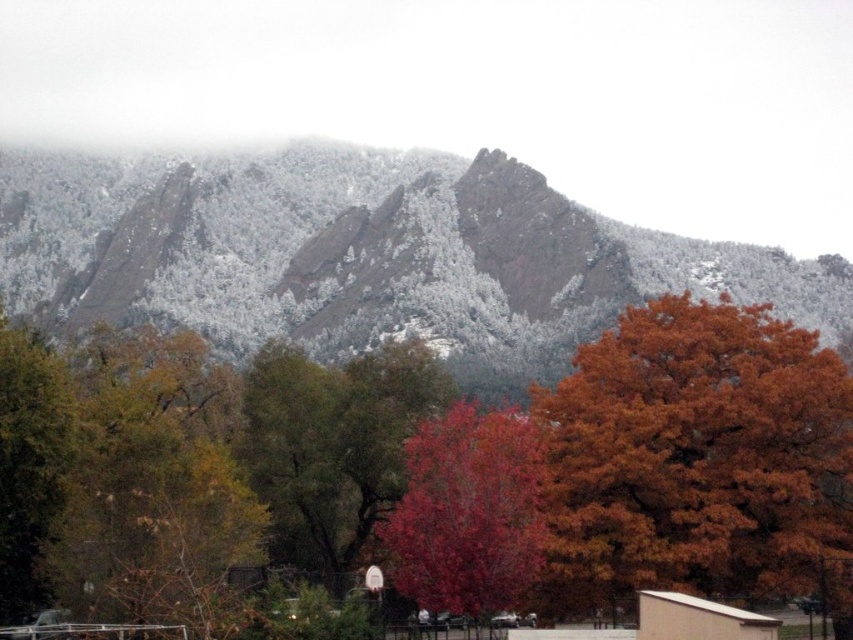
Is snow-covered rock at upper center above shiny red tree at center?

Yes.

Who is shorter, snow-covered rock at upper center or shiny red tree at center?

With less height is shiny red tree at center.

Who is more forward, (x=103, y=232) or (x=436, y=438)?

Positioned in front is point (x=436, y=438).

This screenshot has width=853, height=640. Identify the location of snow-covered rock at upper center. (364, 256).

Locate an element on the screen. orange matte tree at center is located at coordinates (426, 468).

Can you confirm if orange matte tree at center is shorter than snow-covered rock at upper center?

Yes, orange matte tree at center is shorter than snow-covered rock at upper center.

Image resolution: width=853 pixels, height=640 pixels. Find the location of `orange matte tree at center`. orange matte tree at center is located at coordinates (426, 468).

Where is `orange matte tree at center`? This screenshot has width=853, height=640. orange matte tree at center is located at coordinates (426, 468).

The image size is (853, 640). Identify the location of snow-covered rock at upper center. (364, 256).

Locate an element on the screen. snow-covered rock at upper center is located at coordinates (364, 256).

This screenshot has height=640, width=853. Find the location of `snow-covered rock at upper center`. snow-covered rock at upper center is located at coordinates (364, 256).